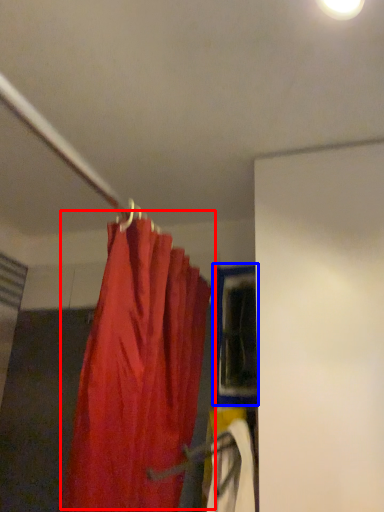
Question: Which object is further to the camera taking this photo, curtain (highlighted by a red box) or window (highlighted by a blue box)?

Choices:
 (A) curtain
 (B) window

Answer: (B)